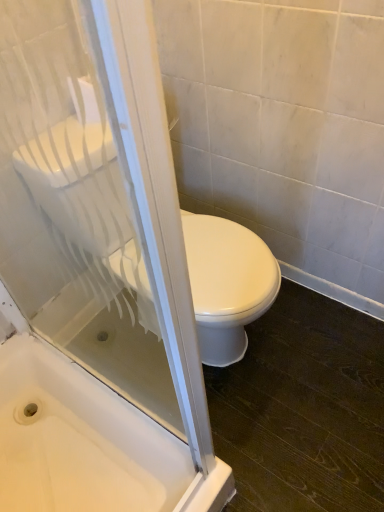
This screenshot has width=384, height=512. Describe the element at coordinates (54, 177) in the screenshot. I see `transparent glass screen door at upper left` at that location.

Where is `white glossy bathtub at lower left`? white glossy bathtub at lower left is located at coordinates (79, 440).

I want to click on transparent glass screen door at upper left, so click(x=54, y=177).

This screenshot has height=512, width=384. Identify the location of toilet behind the transparent glass screen door at upper left. (227, 283).

How many degrees apart are the facing directions of transparent glass screen door at upper left and white glossy toilet at center?

The facing directions of transparent glass screen door at upper left and white glossy toilet at center are 0.251 degrees apart.

Between transparent glass screen door at upper left and white glossy toilet at center, which one has smaller size?

transparent glass screen door at upper left.

Can you see transparent glass screen door at upper left touching white glossy toilet at center?

They are not placed beside each other.

Could you tell me if white glossy bathtub at lower left is facing transparent glass screen door at upper left?

No, white glossy bathtub at lower left is not aimed at transparent glass screen door at upper left.

The image size is (384, 512). Find the location of `screen door located on the right of white glossy bathtub at lower left`. screen door located on the right of white glossy bathtub at lower left is located at coordinates (54, 177).

How many degrees apart are the facing directions of white glossy bathtub at lower left and transparent glass screen door at upper left?

There is a 0.678-degree angle between the facing directions of white glossy bathtub at lower left and transparent glass screen door at upper left.

Is white glossy bathtub at lower left not inside transparent glass screen door at upper left?

white glossy bathtub at lower left lies outside transparent glass screen door at upper left's area.

From a real-world perspective, is white glossy toilet at center physically above transparent glass screen door at upper left?

Incorrect, from a real-world perspective, white glossy toilet at center is lower than transparent glass screen door at upper left.

Between white glossy toilet at center and transparent glass screen door at upper left, which one has smaller width?

transparent glass screen door at upper left.

Identify the location of toilet behind the transparent glass screen door at upper left. (227, 283).

Is white glossy toilet at center at the right side of transparent glass screen door at upper left?

Correct, you'll find white glossy toilet at center to the right of transparent glass screen door at upper left.

From the image's perspective, is white glossy bathtub at lower left over white glossy toilet at center?

No.

Considering the relative sizes of white glossy bathtub at lower left and white glossy toilet at center in the image provided, is white glossy bathtub at lower left thinner than white glossy toilet at center?

No.

Is white glossy bathtub at lower left looking in the opposite direction of white glossy toilet at center?

No, white glossy bathtub at lower left's orientation is not away from white glossy toilet at center.

In terms of height, does white glossy bathtub at lower left look taller or shorter compared to white glossy toilet at center?

Considering their sizes, white glossy bathtub at lower left has less height than white glossy toilet at center.

From the image's perspective, would you say white glossy toilet at center is positioned over white glossy bathtub at lower left?

Indeed, from the image's perspective, white glossy toilet at center is shown above white glossy bathtub at lower left.

From a real-world perspective, is white glossy toilet at center physically located above or below white glossy bathtub at lower left?

In terms of real-world spatial position, white glossy toilet at center is above white glossy bathtub at lower left.

How different are the orientations of white glossy toilet at center and white glossy bathtub at lower left in degrees?

The angle between the facing direction of white glossy toilet at center and the facing direction of white glossy bathtub at lower left is 0.427 degrees.

Which object is wider, white glossy toilet at center or white glossy bathtub at lower left?

Wider between the two is white glossy bathtub at lower left.

Is transparent glass screen door at upper left facing away from white glossy bathtub at lower left?

Absolutely, transparent glass screen door at upper left is directed away from white glossy bathtub at lower left.

How distant is transparent glass screen door at upper left from white glossy bathtub at lower left?

transparent glass screen door at upper left is 5.67 inches away from white glossy bathtub at lower left.

Who is bigger, transparent glass screen door at upper left or white glossy bathtub at lower left?

With larger size is white glossy bathtub at lower left.

Find the location of `screen door in front of the white glossy toilet at center`. screen door in front of the white glossy toilet at center is located at coordinates (54, 177).

Identify the location of screen door above the white glossy bathtub at lower left (from the image's perspective). (54, 177).

In the scene shown: Looking at the image, which one is located closer to white glossy bathtub at lower left, white glossy toilet at center or transparent glass screen door at upper left?

The object closer to white glossy bathtub at lower left is transparent glass screen door at upper left.

Which object lies further to the anchor point white glossy toilet at center, white glossy bathtub at lower left or transparent glass screen door at upper left?

white glossy bathtub at lower left is further to white glossy toilet at center.

From the image, which object appears to be nearer to transparent glass screen door at upper left, white glossy toilet at center or white glossy bathtub at lower left?

white glossy bathtub at lower left is closer to transparent glass screen door at upper left.

Based on their spatial positions, is transparent glass screen door at upper left or white glossy bathtub at lower left closer to white glossy toilet at center?

Based on the image, transparent glass screen door at upper left appears to be nearer to white glossy toilet at center.

Consider the image. From the image, which object appears to be nearer to white glossy bathtub at lower left, transparent glass screen door at upper left or white glossy toilet at center?

transparent glass screen door at upper left is closer to white glossy bathtub at lower left.

Looking at the image, which one is located closer to transparent glass screen door at upper left, white glossy bathtub at lower left or white glossy toilet at center?

The object closer to transparent glass screen door at upper left is white glossy bathtub at lower left.

At what (x,y) coordinates should I click in order to perform the action: click on toilet between transparent glass screen door at upper left and white glossy bathtub at lower left in the front-back direction. Please return your answer as a coordinate pair (x, y). This screenshot has height=512, width=384. Looking at the image, I should click on (227, 283).